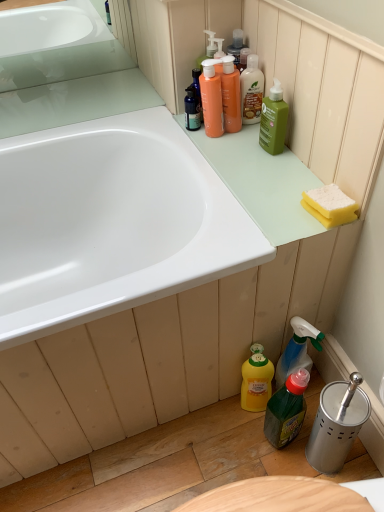
Identify the location of free space in front of matte orange pump bottles at upper center, which is the second cleaning product from top to bottom. 236,161.